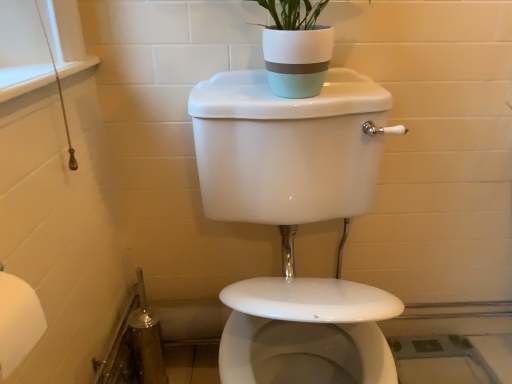
Measure the distance between white glossy porcelain at center and camera.

They are 26.13 inches apart.

Consider the image. In order to face white glossy porcelain at center, should I rotate leftwards or rightwards?

Turn right by 6.656 degrees to look at white glossy porcelain at center.

Image resolution: width=512 pixels, height=384 pixels. I want to click on white glossy porcelain at center, so click(295, 222).

Describe the element at coordinates (295, 222) in the screenshot. I see `white glossy porcelain at center` at that location.

At what (x,y) coordinates should I click in order to perform the action: click on white glossy porcelain at center. Please return your answer as a coordinate pair (x, y). This screenshot has height=384, width=512. Looking at the image, I should click on (295, 222).